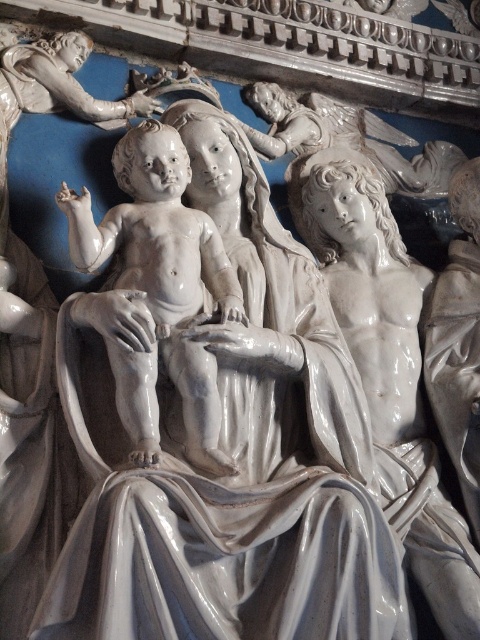
Question: Is matte white baby at center further to camera compared to glossy white statue at center?

Choices:
 (A) yes
 (B) no

Answer: (B)

Question: Among these points, which one is nearest to the camera?

Choices:
 (A) (214, 298)
 (B) (393, 461)

Answer: (A)

Question: Among these points, which one is nearest to the camera?

Choices:
 (A) (465, 586)
 (B) (121, 376)

Answer: (B)

Question: Among these points, which one is nearest to the camera?

Choices:
 (A) (156, 257)
 (B) (457, 620)

Answer: (B)

Question: Is the position of matte white baby at center more distant than that of glossy white statue at center?

Choices:
 (A) no
 (B) yes

Answer: (A)

Question: Does matte white baby at center have a greater width compared to glossy white statue at center?

Choices:
 (A) yes
 (B) no

Answer: (A)